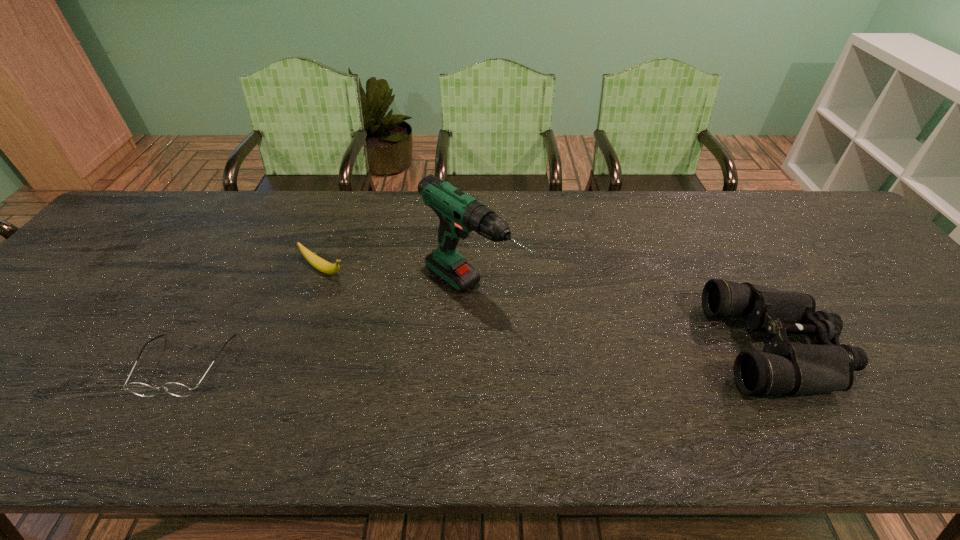
Where is `vacant space on the desktop that is between the spectacles and the binoculars and is positioned at the stem of the third object from right to left`? vacant space on the desktop that is between the spectacles and the binoculars and is positioned at the stem of the third object from right to left is located at coordinates (470, 356).

At what (x,y) coordinates should I click in order to perform the action: click on vacant space on the desktop that is between the spectacles and the binoculars and is positioned on the handle side of the tallest object. Please return your answer as a coordinate pair (x, y). Image resolution: width=960 pixels, height=540 pixels. Looking at the image, I should click on (553, 353).